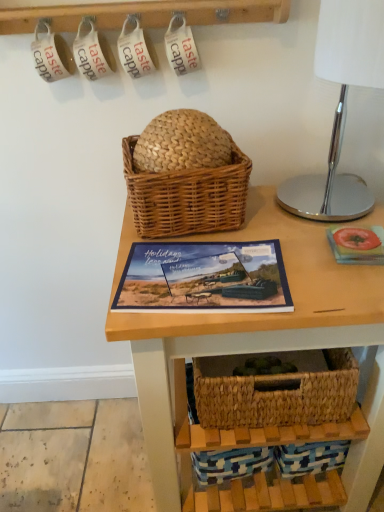
You are a GUI agent. You are given a task and a screenshot of the screen. Output one action in this format:
    pyautogui.click(x=<x>, y=<y>)
    Task: Click on the free area below matte blue book at center (from a real-world perspective)
    The width and height of the screenshot is (384, 512).
    Given the screenshot: What is the action you would take?
    pyautogui.click(x=196, y=277)